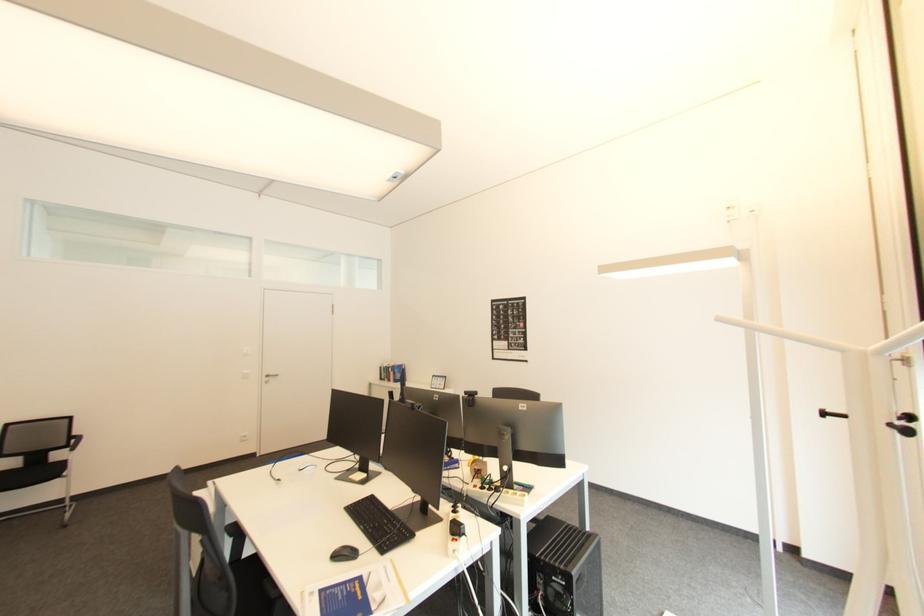
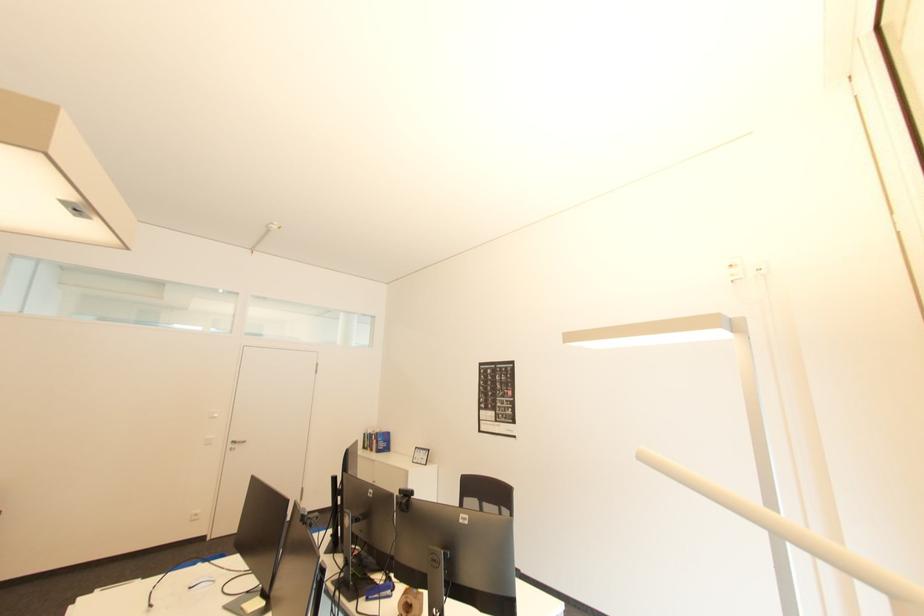
Looking at this image, the images are taken continuously from a first-person perspective. In which direction are you moving?

The movement direction of the cameraman is right, forward.